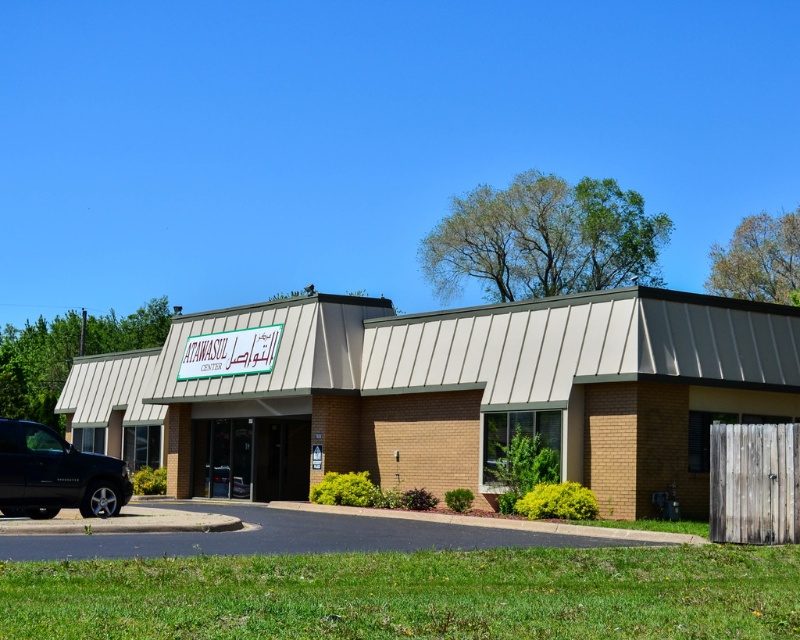
Question: Which of the following is the farthest from the observer?

Choices:
 (A) brown brick building at center
 (B) shiny black truck at lower left

Answer: (A)

Question: Can you confirm if brown brick building at center is positioned to the right of white plastic sign at center?

Choices:
 (A) no
 (B) yes

Answer: (B)

Question: Which object is positioned closest to the brown brick building at center?

Choices:
 (A) white plastic sign at center
 (B) shiny black truck at lower left

Answer: (A)

Question: Which point is closer to the camera?

Choices:
 (A) (186, 362)
 (B) (206, 392)

Answer: (B)

Question: Does brown brick building at center appear over shiny black truck at lower left?

Choices:
 (A) no
 (B) yes

Answer: (B)

Question: Is shiny black truck at lower left positioned in front of white plastic sign at center?

Choices:
 (A) no
 (B) yes

Answer: (B)